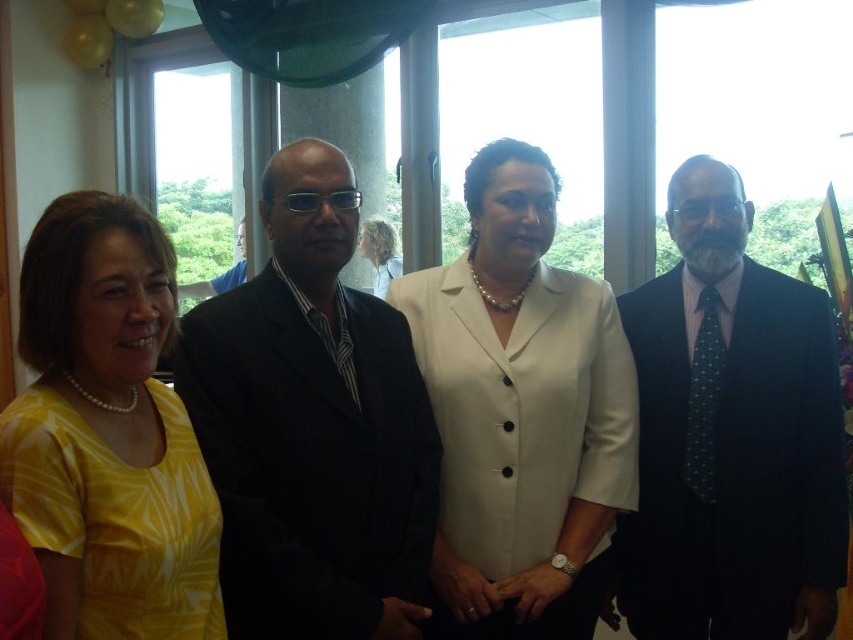
You are a photographer at this event and need to adjust the camera settings for a group photo. Since the black suit at center and the yellow printed blouse at center are both in the frame, which one might require more exposure adjustment due to its size?

The black suit at center is bigger than the yellow printed blouse at center, so it might require more exposure adjustment because larger objects can sometimes affect lighting and require more precise settings to ensure proper exposure.